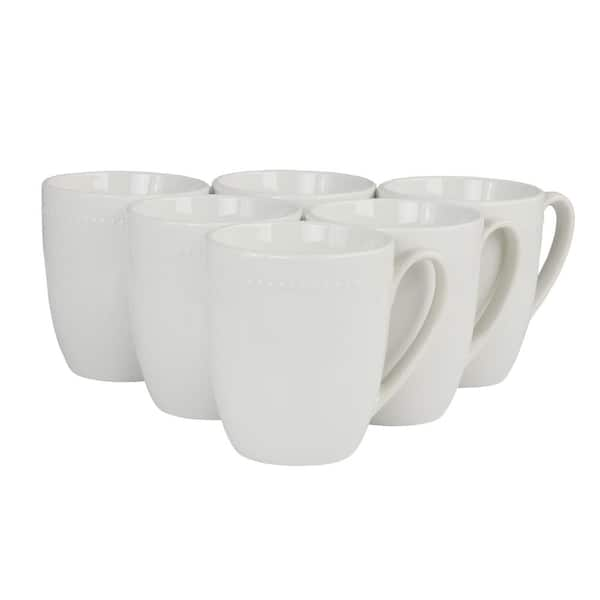
Locate an element on the screen. coffee mugs is located at coordinates (124, 189), (163, 220), (283, 181), (446, 190), (410, 234), (326, 248).